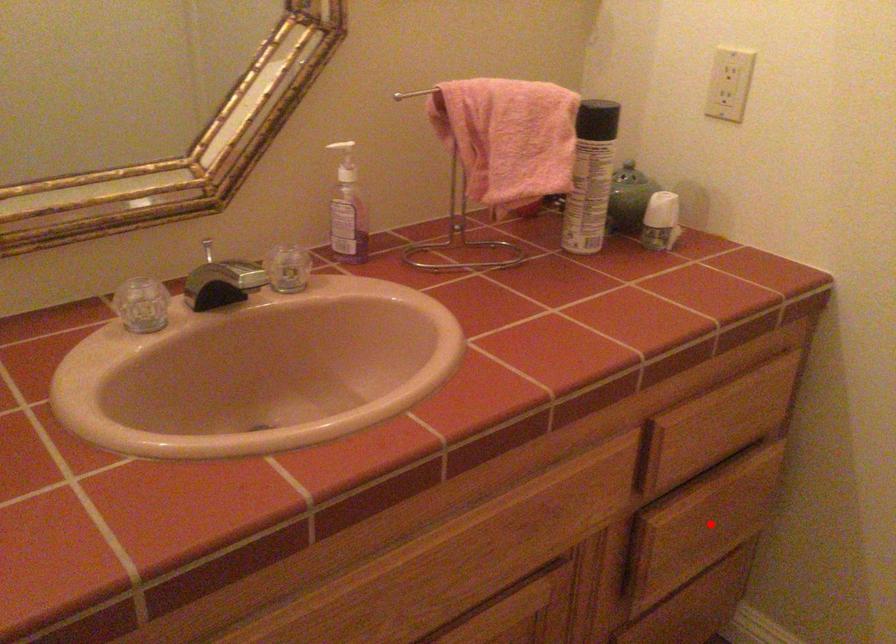
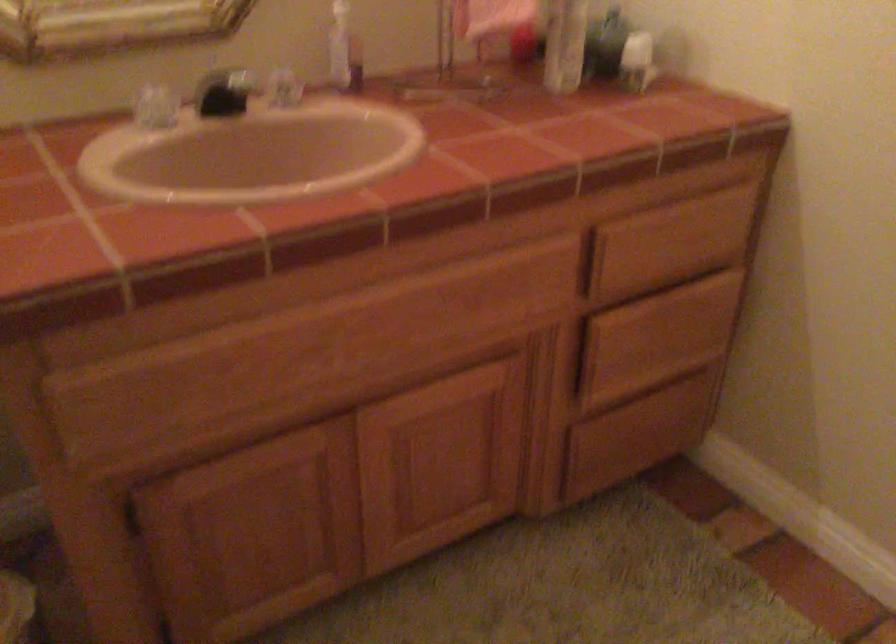
The point at the highlighted location is marked in the first image. Where is the corresponding point in the second image?

(657, 337)